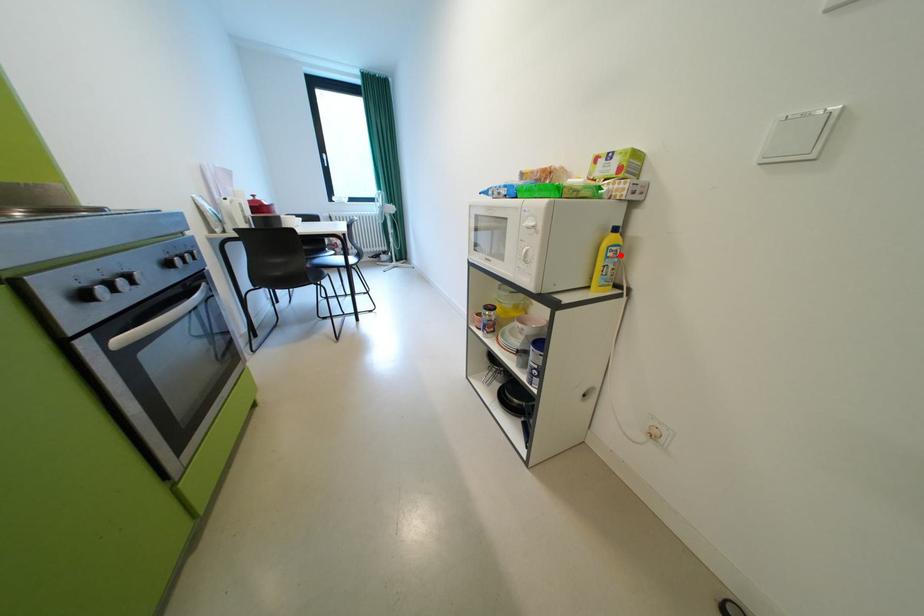
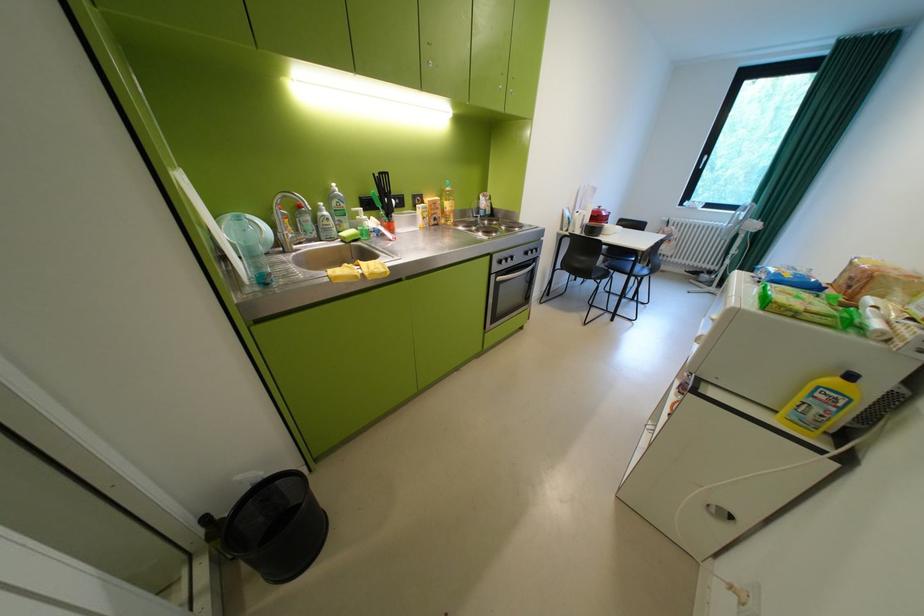
Where in the second image is the point corresponding to the highlighted location from the first image?

(830, 395)